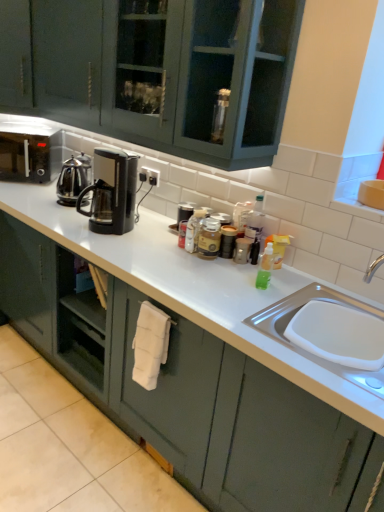
The height and width of the screenshot is (512, 384). I want to click on vacant space underneath black plastic coffee maker at center, which is the 2th kitchen appliance from back to front (from a real-world perspective), so click(124, 228).